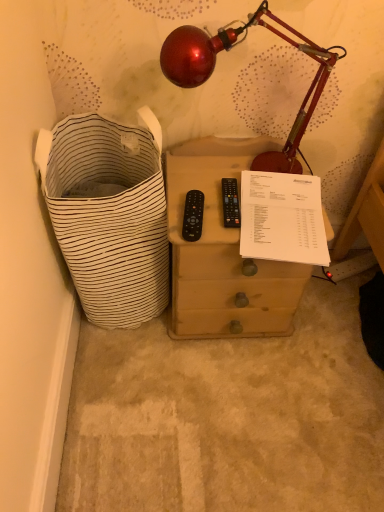
Find the location of a particular element. This screenshot has height=512, width=384. vacant area situated below metallic red lamp at upper center (from a real-world perspective) is located at coordinates (211, 175).